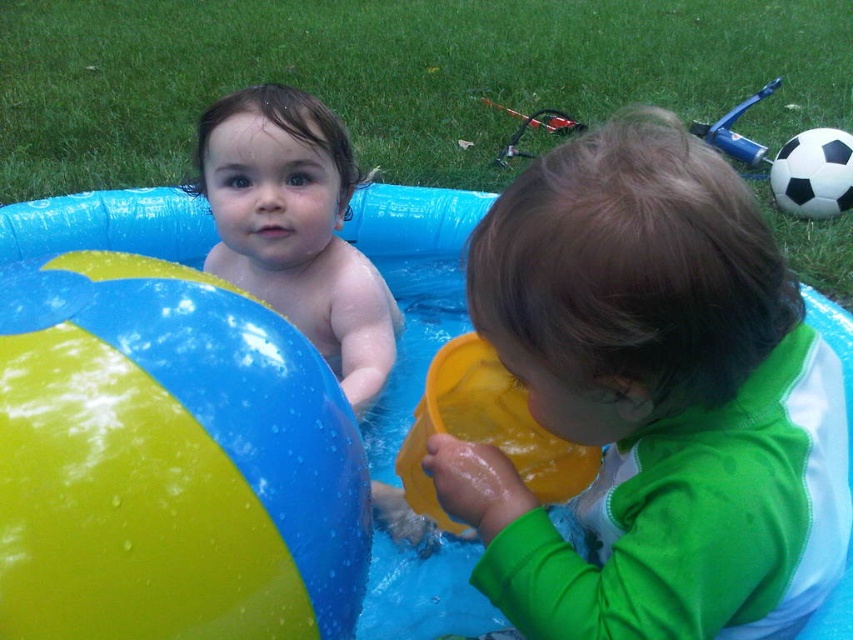
In the scene shown: You are planning to place the black matte soccer ball at upper right into the blue rubber pool at center. Can you determine if the ball will fit inside the pool?

The blue rubber pool at center might be wider than black matte soccer ball at upper right, so it is possible that the ball will fit inside the pool. However, without exact measurements, we cannot be certain.

You are standing at the point marked as point (766, 278) in the image and want to hand a beach ball to the child in the green and white swimsuit. Can you reach them without moving from your current position? The beach ball is 12 inches in diameter.

The distance between you and the child in the green and white swimsuit is 32.05 inches. Since the beach ball has a diameter of 12 inches, you can stretch your arm to reach them as the distance is within a typical arm reach for an adult. However, if you are a child, it might be a bit challenging but still possible with stretching.

You are a parent trying to ensure safety for your children playing in the blue rubber pool at center and the black matte soccer ball at upper right. Considering their sizes, which object would you place further away from the pool to prevent slipping hazards?

The blue rubber pool at center is larger than the black matte soccer ball at upper right, so you should place the black matte soccer ball at upper right further away from the pool to prevent slipping hazards.